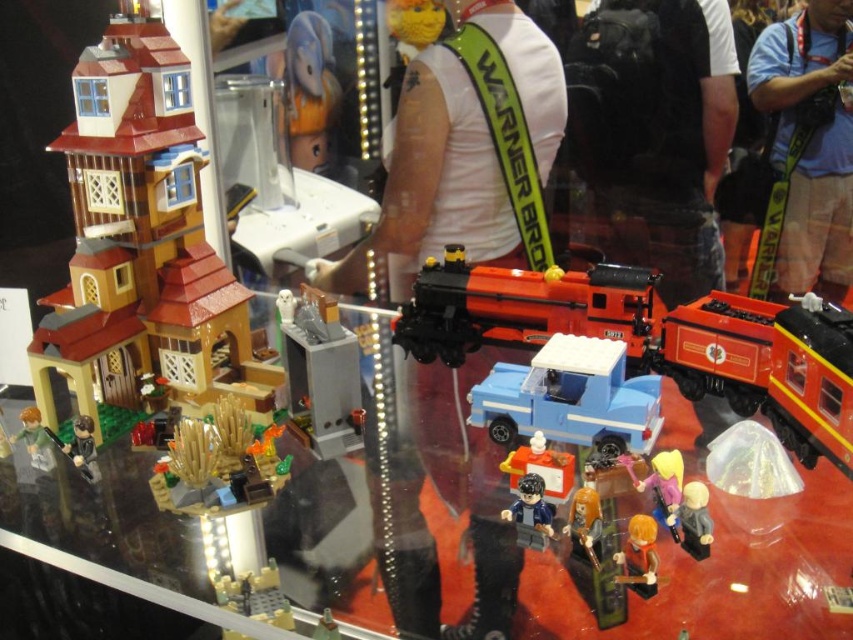
Image resolution: width=853 pixels, height=640 pixels. What do you see at coordinates (807, 147) in the screenshot? I see `blue fabric shirt at center` at bounding box center [807, 147].

What are the coordinates of `blue fabric shirt at center` in the screenshot? It's located at (807, 147).

Between blue fabric shirt at center and dark blue fabric jacket at center, which one is positioned higher?

blue fabric shirt at center is above.

Based on the photo, is blue fabric shirt at center to the left of dark blue fabric jacket at center from the viewer's perspective?

In fact, blue fabric shirt at center is to the right of dark blue fabric jacket at center.

Who is more distant from viewer, (845, 289) or (543, 547)?

The point (845, 289) is more distant.

At what (x,y) coordinates should I click in order to perform the action: click on blue fabric shirt at center. Please return your answer as a coordinate pair (x, y). Looking at the image, I should click on (807, 147).

How much distance is there between translucent orange minifigure at center and brown fabric figure at lower left?

translucent orange minifigure at center and brown fabric figure at lower left are 65.39 centimeters apart from each other.

Who is more forward, (598,557) or (90,460)?

Point (598,557) is more forward.

Where is `translucent orange minifigure at center`? translucent orange minifigure at center is located at coordinates pyautogui.click(x=585, y=522).

Where is `translucent orange minifigure at center`? translucent orange minifigure at center is located at coordinates (585, 522).